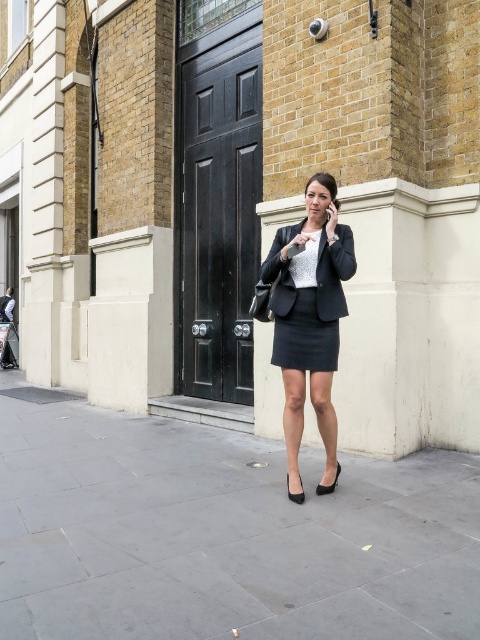
Who is more distant from viewer, (15, 486) or (312, 353)?

Point (15, 486)

Can you confirm if gray concrete pavement at center is wider than matte black skirt at center?

Yes.

You are a GUI agent. You are given a task and a screenshot of the screen. Output one action in this format:
    pyautogui.click(x=<x>, y=<y>)
    Task: Click on the gray concrete pavement at center
    Image resolution: width=480 pixels, height=640 pixels.
    Given the screenshot: What is the action you would take?
    pyautogui.click(x=224, y=534)

Identify the location of gray concrete pavement at center. click(x=224, y=534).

From the picture: Who is lower down, matte black blazer at center or matte black skirt at center?

matte black blazer at center

Where is `matte black blazer at center`? The image size is (480, 640). matte black blazer at center is located at coordinates (310, 321).

Can you confirm if gray concrete pavement at center is bigger than matte black blazer at center?

Incorrect, gray concrete pavement at center is not larger than matte black blazer at center.

Measure the distance from gray concrete pavement at center to matte black blazer at center.

gray concrete pavement at center and matte black blazer at center are 3.48 feet apart.

Is point (72, 452) farther from camera compared to point (340, 273)?

Yes, point (72, 452) is behind point (340, 273).

Where is `gray concrete pavement at center`? The width and height of the screenshot is (480, 640). gray concrete pavement at center is located at coordinates (224, 534).